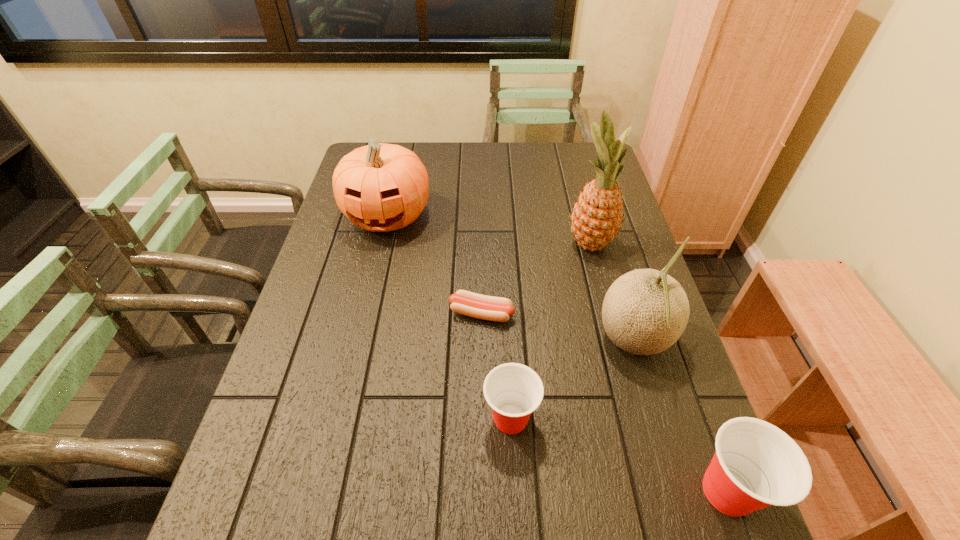
Find the location of a particular element. Image resolution: width=960 pixels, height=540 pixels. the fifth farthest object is located at coordinates (513, 391).

At what (x,y) coordinates should I click in order to perform the action: click on the second shortest object. Please return your answer as a coordinate pair (x, y). Looking at the image, I should click on (513, 391).

This screenshot has width=960, height=540. In order to click on the right cup in this screenshot , I will do `click(756, 465)`.

The height and width of the screenshot is (540, 960). Identify the location of the taller cup. (756, 465).

Locate an element on the screen. the leftmost object is located at coordinates (380, 187).

Where is `the tallest object`? the tallest object is located at coordinates (597, 216).

I want to click on cantaloup, so click(x=645, y=311).

At what (x,y) coordinates should I click in order to perform the action: click on sausage. Please return your answer as a coordinate pair (x, y). Image resolution: width=960 pixels, height=540 pixels. Looking at the image, I should click on (464, 302).

Find the location of `free location located on the back of the second nearest object`. free location located on the back of the second nearest object is located at coordinates (507, 355).

Locate an element on the screen. The height and width of the screenshot is (540, 960). vacant area located on the left of the nearer cup is located at coordinates (613, 491).